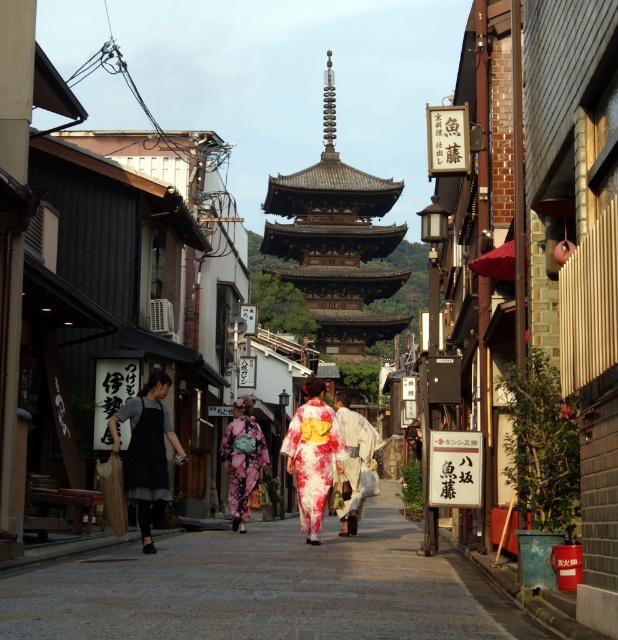
You are standing on the street and see two points marked in the image. The first point is at coordinates point [302,234] and the second is at point [143,456]. Which point is closer to you?

Point [143,456] is closer to you because it is in front of point [302,234].

You are a photographer planning to take a photo of the dark gray apron at left and the floral silk kimono at center. Since you want to ensure both are clearly visible, which object should you focus on to account for their sizes?

You should focus on the dark gray apron at left because it is smaller in width compared to the floral silk kimono at center, ensuring both are captured clearly.

You are a tourist standing on the street and want to take a photo of both the wooden pagoda at center and the dark gray apron at left in the same frame. Given that your camera has a maximum focal length that allows capturing objects up to 500 feet apart in the same shot, will you be able to include both in your photo?

The wooden pagoda at center and dark gray apron at left are 537.26 feet apart, which exceeds the camera maximum focal length of 500 feet. Therefore, you cannot capture both in the same frame.